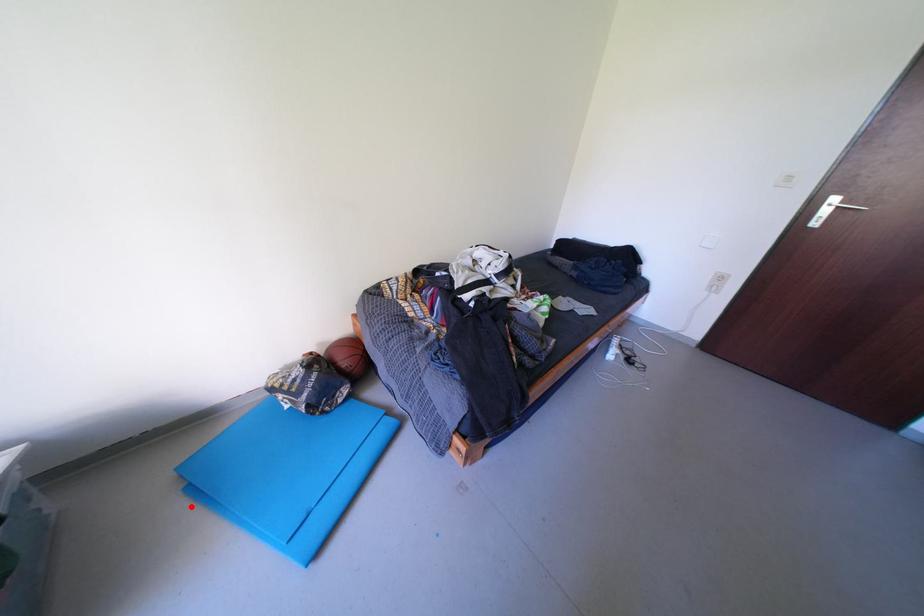
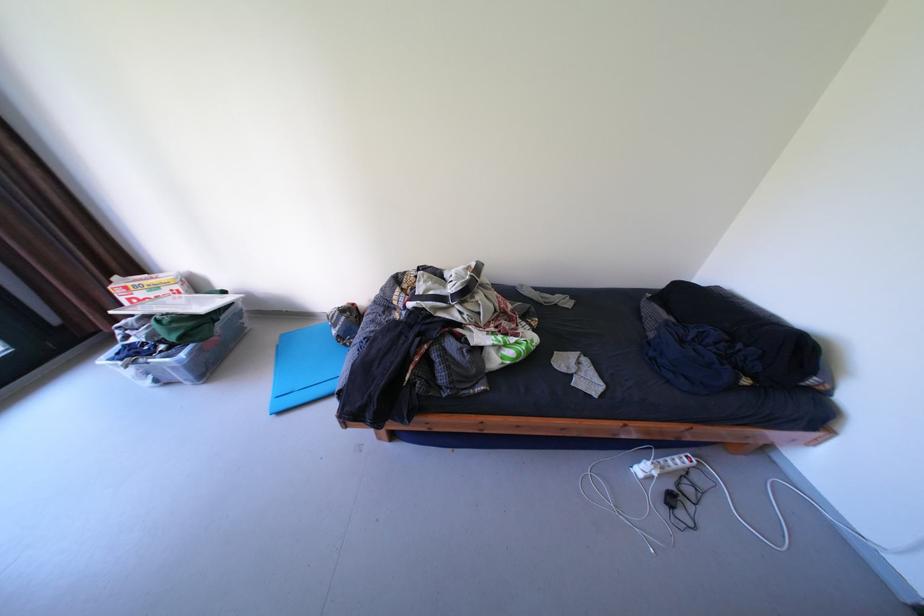
In the second image, find the point that corresponds to the highlighted location in the first image.

(283, 353)